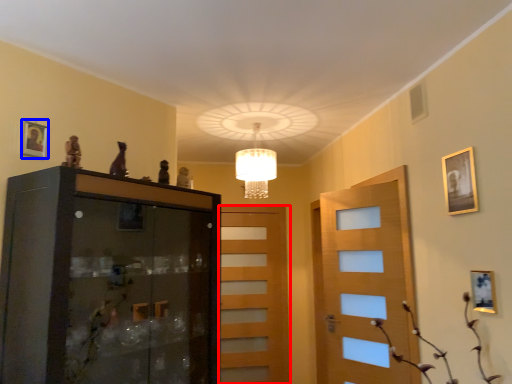
Question: Which object is further to the camera taking this photo, door (highlighted by a red box) or picture frame (highlighted by a blue box)?

Choices:
 (A) door
 (B) picture frame

Answer: (A)